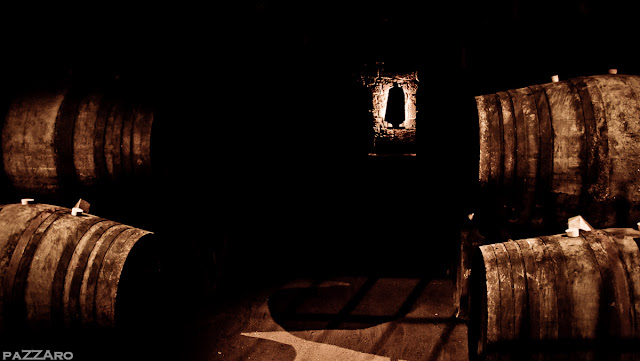
Find the location of `light source`. light source is located at coordinates (410, 104), (380, 96).